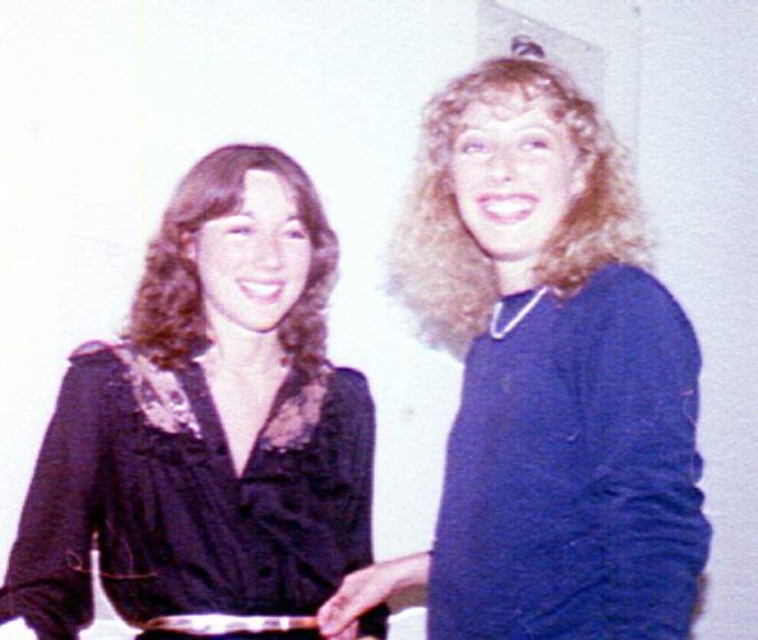
Question: Is blue woolen sweater at right smaller than black satin blouse at left?

Choices:
 (A) no
 (B) yes

Answer: (A)

Question: Can you confirm if black satin blouse at left is positioned to the right of blue matte sweater at right?

Choices:
 (A) yes
 (B) no

Answer: (B)

Question: Which object appears closest to the camera in this image?

Choices:
 (A) blue woolen sweater at right
 (B) blue matte sweater at right

Answer: (B)

Question: Which object is the closest to the blue matte sweater at right?

Choices:
 (A) blue woolen sweater at right
 (B) black satin blouse at left

Answer: (A)

Question: Among these points, which one is nearest to the camera?

Choices:
 (A) (656, 474)
 (B) (653, 609)

Answer: (B)

Question: Can you confirm if blue woolen sweater at right is thinner than blue matte sweater at right?

Choices:
 (A) yes
 (B) no

Answer: (B)